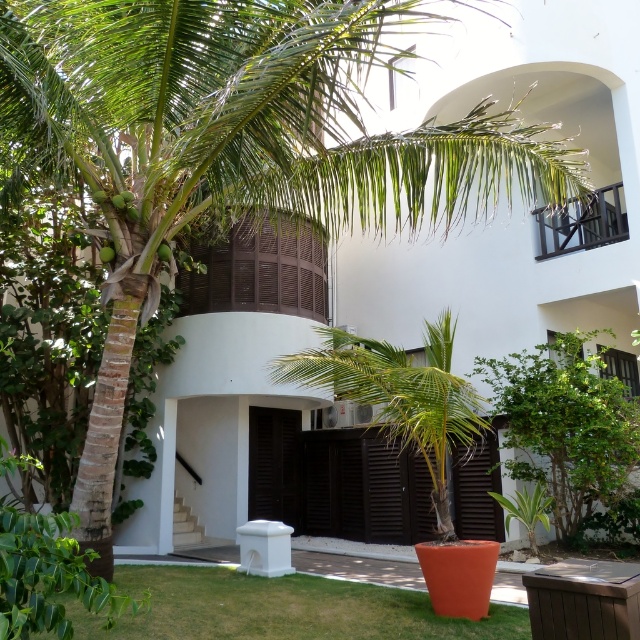
You are standing at the entrance of the building and looking towards the green leafy palm tree at center. Which direction should you walk to reach the green grass at lower left?

The green grass at lower left is located below the green leafy palm tree at center, so you should walk towards the lower left direction to reach it.

Please look at the image. There is a point at coordinates (280, 609). According to the scene description, what object is located at that point?

The green grass at lower left is located at point (280, 609).

You are standing at the entrance of the building and want to place a decorative stone on the green grass at lower left. According to the image, where exactly should you place it?

The green grass at lower left is located at point (280,609), so you should place the decorative stone there.